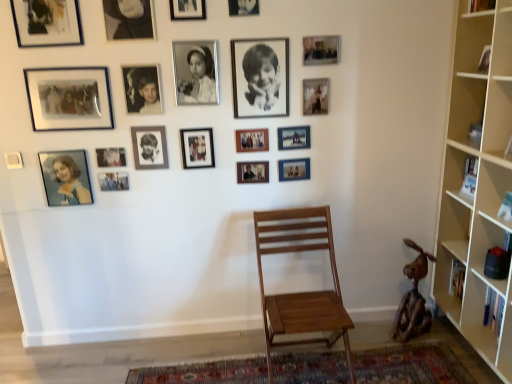
Identify the location of vacant region under carpeted mat at center (from a real-world perspective). (352, 352).